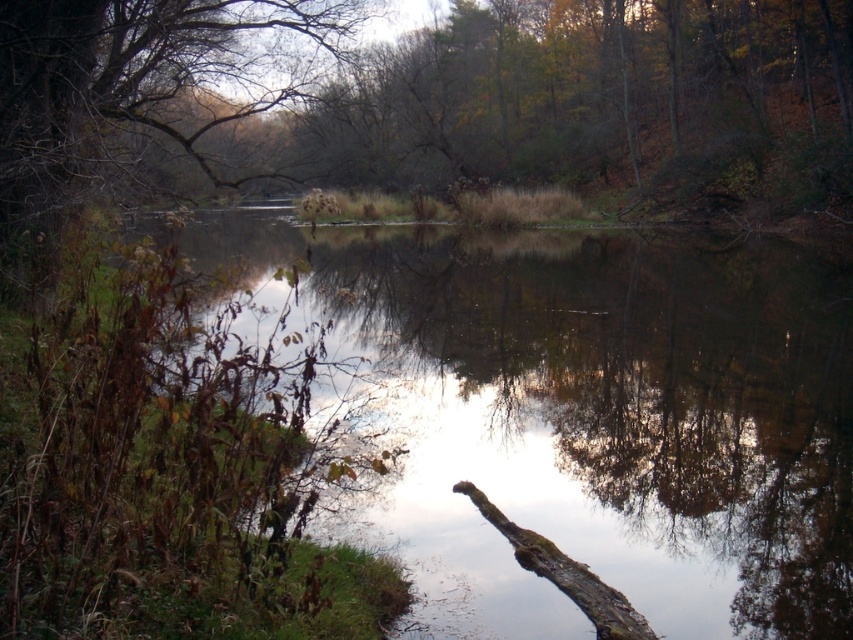
Consider the image. Can you confirm if brown leafless branches at upper left is taller than brown rough tree trunk at lower center?

Correct, brown leafless branches at upper left is much taller as brown rough tree trunk at lower center.

Can you confirm if brown leafless branches at upper left is bigger than brown rough tree trunk at lower center?

Yes, brown leafless branches at upper left is bigger than brown rough tree trunk at lower center.

Does point (22, 205) come in front of point (547, 548)?

No, it is not.

Find the location of a particular element. The height and width of the screenshot is (640, 853). brown leafless branches at upper left is located at coordinates (136, 93).

Is green mossy log at lower left to the right of brown leafless branches at upper left from the viewer's perspective?

Correct, you'll find green mossy log at lower left to the right of brown leafless branches at upper left.

Which is behind, point (318, 259) or point (187, 35)?

The point (318, 259) is behind.

Image resolution: width=853 pixels, height=640 pixels. I want to click on green mossy log at lower left, so click(x=587, y=416).

Which is above, green mossy log at lower left or brown rough tree trunk at lower center?

green mossy log at lower left

Is green mossy log at lower left positioned in front of brown rough tree trunk at lower center?

Yes, green mossy log at lower left is closer to the viewer.

Does point (694, 378) lie in front of point (556, 572)?

That is False.

Where is `green mossy log at lower left`? The image size is (853, 640). green mossy log at lower left is located at coordinates (587, 416).